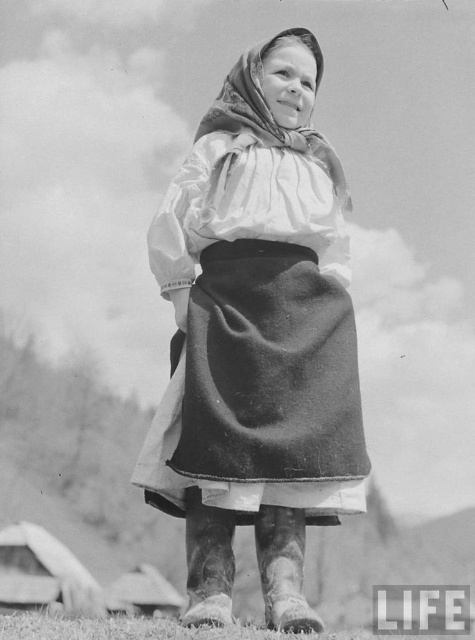
Question: Which object is farther from the camera taking this photo?

Choices:
 (A) white cotton blouse at center
 (B) soft white scarf at center

Answer: (B)

Question: Is white cotton blouse at center in front of soft white scarf at center?

Choices:
 (A) no
 (B) yes

Answer: (B)

Question: Does white cotton blouse at center appear under soft white scarf at center?

Choices:
 (A) no
 (B) yes

Answer: (B)

Question: Can you confirm if white cotton blouse at center is thinner than soft white scarf at center?

Choices:
 (A) yes
 (B) no

Answer: (B)

Question: Which object appears farthest from the camera in this image?

Choices:
 (A) soft white scarf at center
 (B) white cotton blouse at center

Answer: (A)